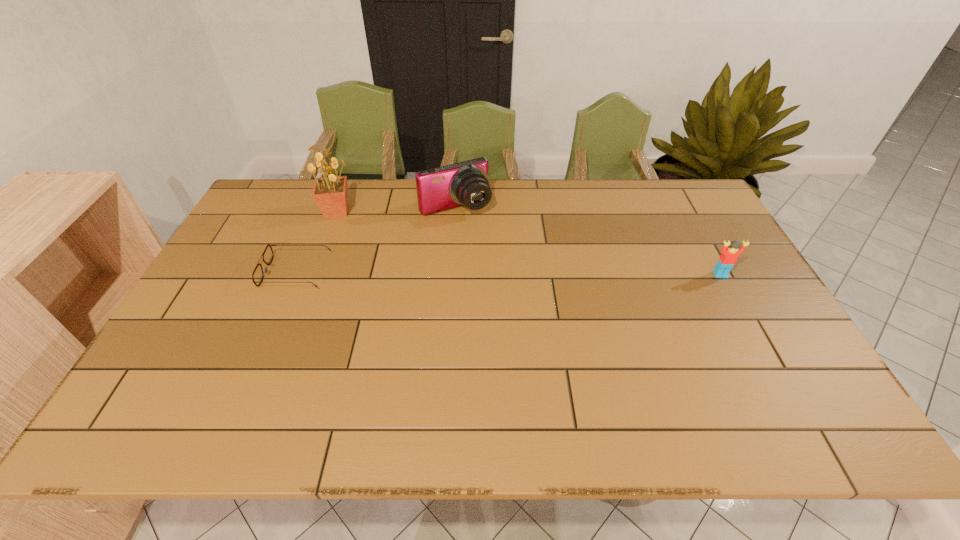
Where is `vacant spot on the desktop that is between the shortest object and the Lego and is positioned on the front-facing side of the third object from left to right`? vacant spot on the desktop that is between the shortest object and the Lego and is positioned on the front-facing side of the third object from left to right is located at coordinates (499, 273).

Image resolution: width=960 pixels, height=540 pixels. I want to click on free spot on the desktop that is between the shortest object and the second shortest object and is positioned at the front of the tallest object with flowers visible, so click(454, 273).